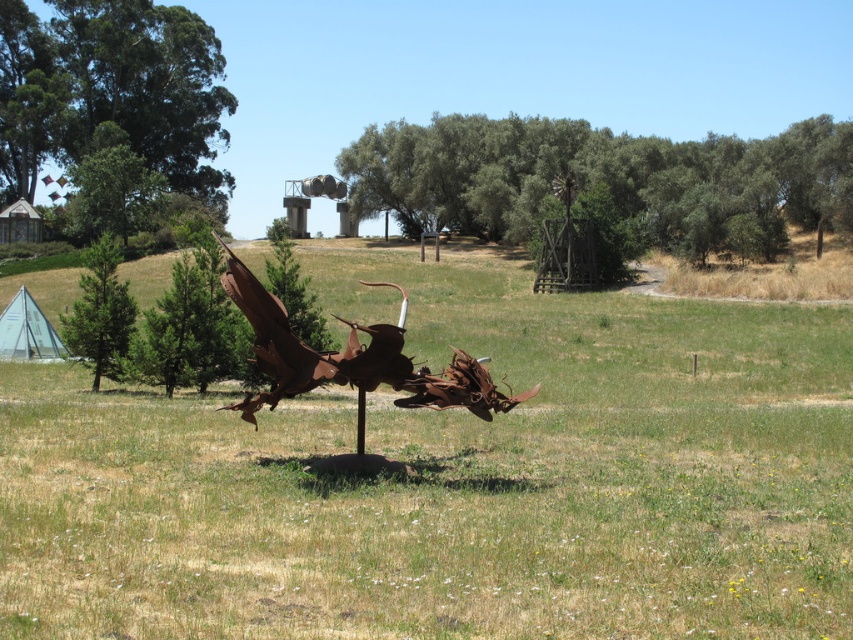
Based on the coordinates provided, what object is located at point (351, 368) in the image?

The point (351, 368) indicates the rusty metal dragon at center.